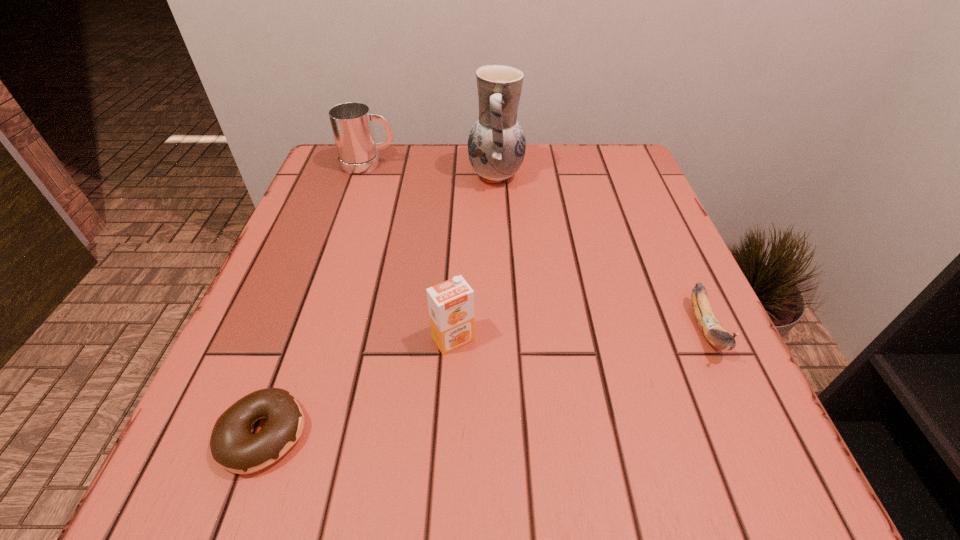
Find the location of `vacant space located on the side of the mug with the handle`. vacant space located on the side of the mug with the handle is located at coordinates (555, 164).

Identify the location of vacant region located on the left of the orange juice. The height and width of the screenshot is (540, 960). (307, 339).

In order to click on vacant space positioned 0.180m on the peel of the banana in this screenshot , I will do `click(779, 488)`.

I want to click on blank space located on the back of the shortest object, so click(x=302, y=326).

Image resolution: width=960 pixels, height=540 pixels. Identify the location of pottery that is at the far edge. (496, 144).

Find the location of a particular element. mug at the far edge is located at coordinates 351,122.

Locate an element on the screen. This screenshot has width=960, height=540. object that is at the near edge is located at coordinates (234, 447).

The image size is (960, 540). In order to click on mug present at the left edge in this screenshot , I will do `click(351, 122)`.

The height and width of the screenshot is (540, 960). I want to click on doughnut located in the left edge section of the desktop, so click(x=234, y=447).

This screenshot has height=540, width=960. I want to click on object that is at the right edge, so click(710, 326).